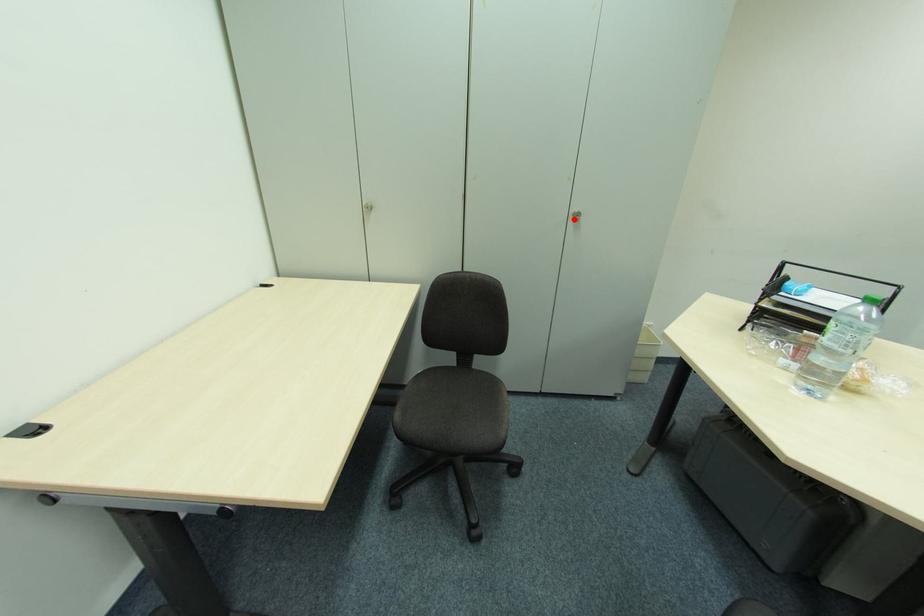
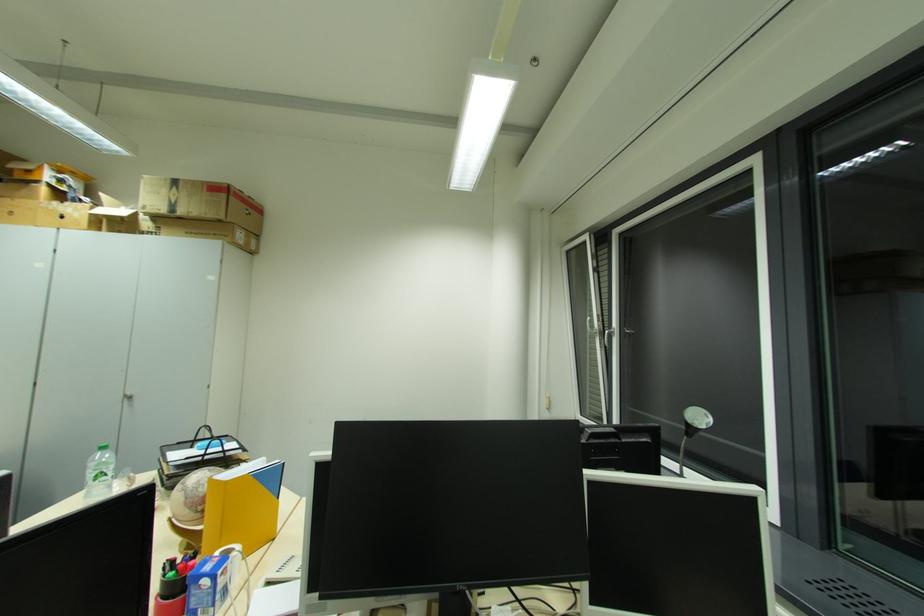
Where in the second image is the point corresponding to the highlighted location from the first image?

(128, 400)